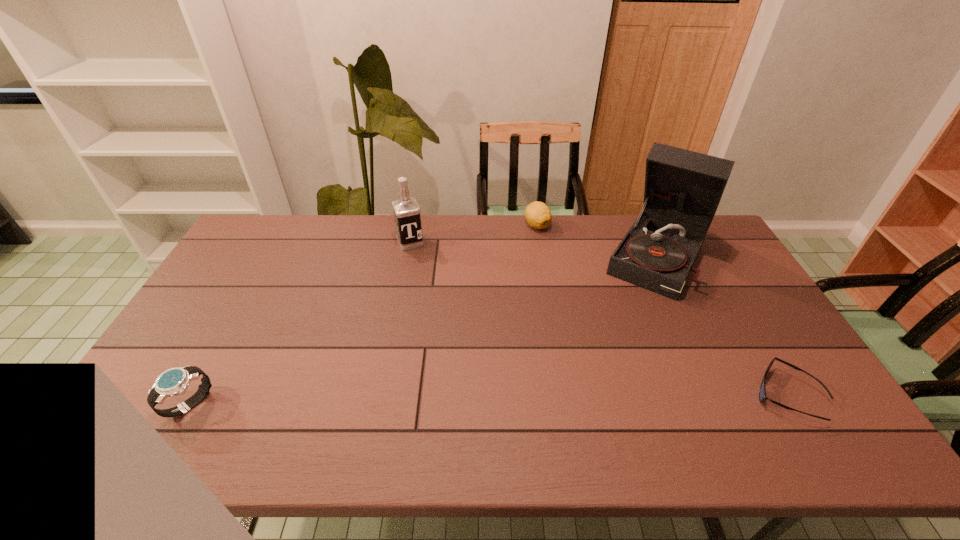
Image resolution: width=960 pixels, height=540 pixels. Find the location of `vacant area located 0.300m at the front of the sunglasses showing the lenses`. vacant area located 0.300m at the front of the sunglasses showing the lenses is located at coordinates (632, 395).

I want to click on vacant space situated at the front of the sunglasses showing the lenses, so click(676, 395).

In order to click on blank space located 0.220m at the stem end of the second shortest object in this screenshot , I will do `click(543, 275)`.

Identify the location of free space located 0.090m at the stem end of the second shortest object. (540, 251).

You are a GUI agent. You are given a task and a screenshot of the screen. Output one action in this format:
    pyautogui.click(x=<x>, y=<y>)
    Task: Click on the free space located 0.110m at the stem end of the second shortest object
    Image resolution: width=960 pixels, height=540 pixels.
    Given the screenshot: What is the action you would take?
    pyautogui.click(x=540, y=254)

Where is `free spot located 0.110m on the front label of the vodka`? The image size is (960, 540). free spot located 0.110m on the front label of the vodka is located at coordinates (422, 269).

You are a GUI agent. You are given a task and a screenshot of the screen. Output one action in this format:
    pyautogui.click(x=<x>, y=<y>)
    Task: Click on the vacant space located on the front label of the vodka
    This screenshot has height=540, width=960.
    Given the screenshot: What is the action you would take?
    pyautogui.click(x=444, y=318)

I want to click on free space located 0.120m on the front label of the vodka, so click(423, 272).

This screenshot has height=540, width=960. In order to click on vacant space located 0.270m on the front-facing side of the tallest object in this screenshot , I will do `click(610, 350)`.

Where is `vacant area situated on the front-facing side of the tallest object`? The image size is (960, 540). vacant area situated on the front-facing side of the tallest object is located at coordinates (604, 360).